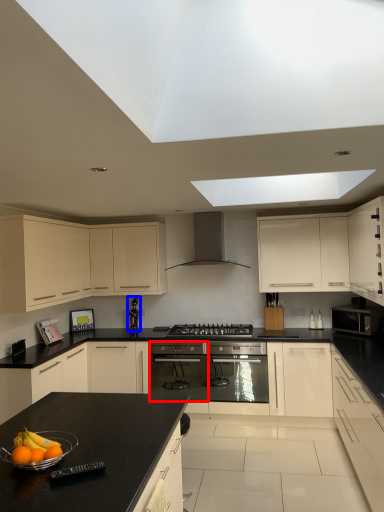
Question: Among these objects, which one is farthest to the camera, appliance (highlighted by a red box) or appliance (highlighted by a blue box)?

Choices:
 (A) appliance
 (B) appliance

Answer: (B)